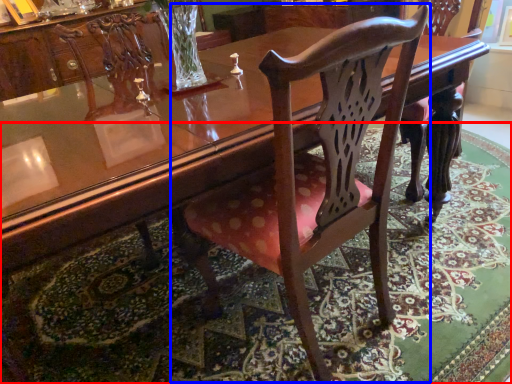
Question: Which point is further to the camera, mat (highlighted by a red box) or chair (highlighted by a blue box)?

Choices:
 (A) mat
 (B) chair

Answer: (A)